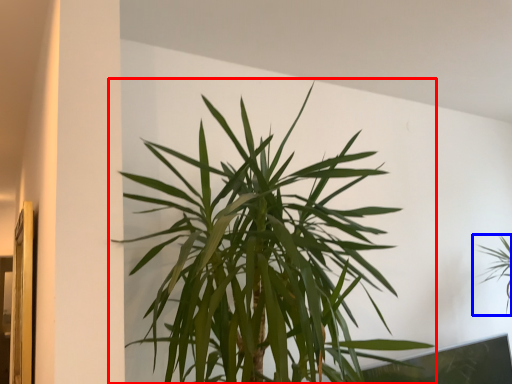
Question: Which of the following is the closest to the observer, houseplant (highlighted by a red box) or houseplant (highlighted by a blue box)?

Choices:
 (A) houseplant
 (B) houseplant

Answer: (A)